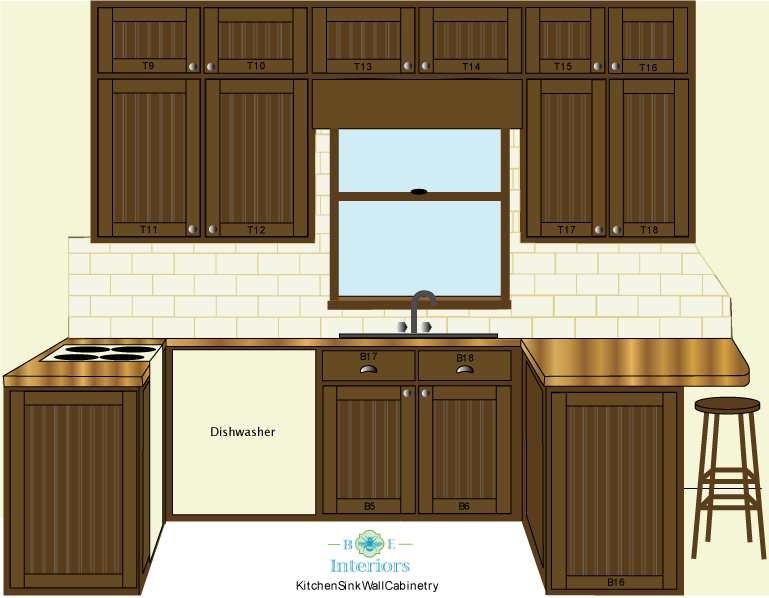
This screenshot has height=598, width=769. Identify the location of brick wall. (610, 294).